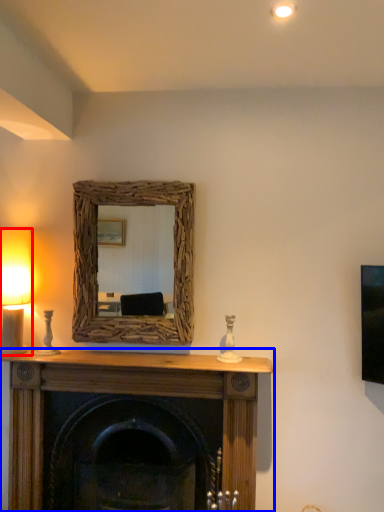
Question: Which of the following is the closest to the observer, table lamp (highlighted by a red box) or fireplace (highlighted by a blue box)?

Choices:
 (A) table lamp
 (B) fireplace

Answer: (B)